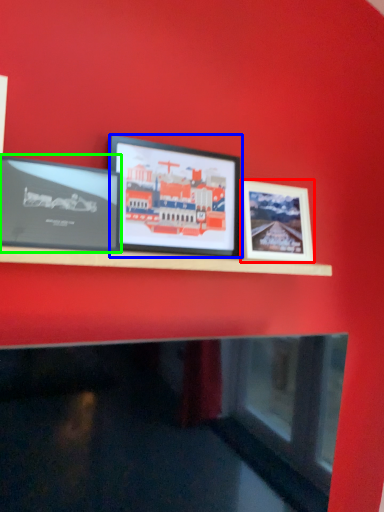
Question: Which is farther away from picture frame (highlighted by a red box)? picture frame (highlighted by a blue box) or picture frame (highlighted by a green box)?

Choices:
 (A) picture frame
 (B) picture frame

Answer: (B)